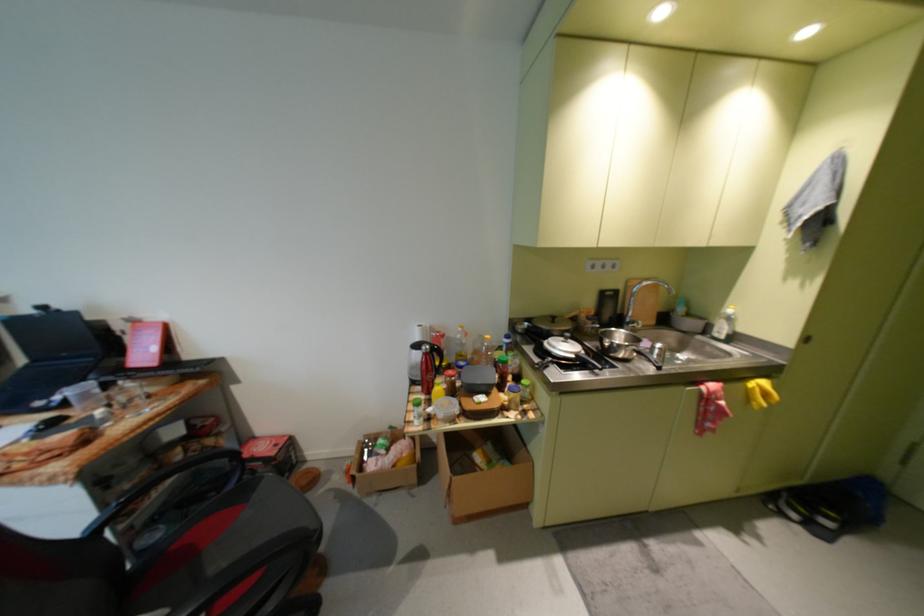
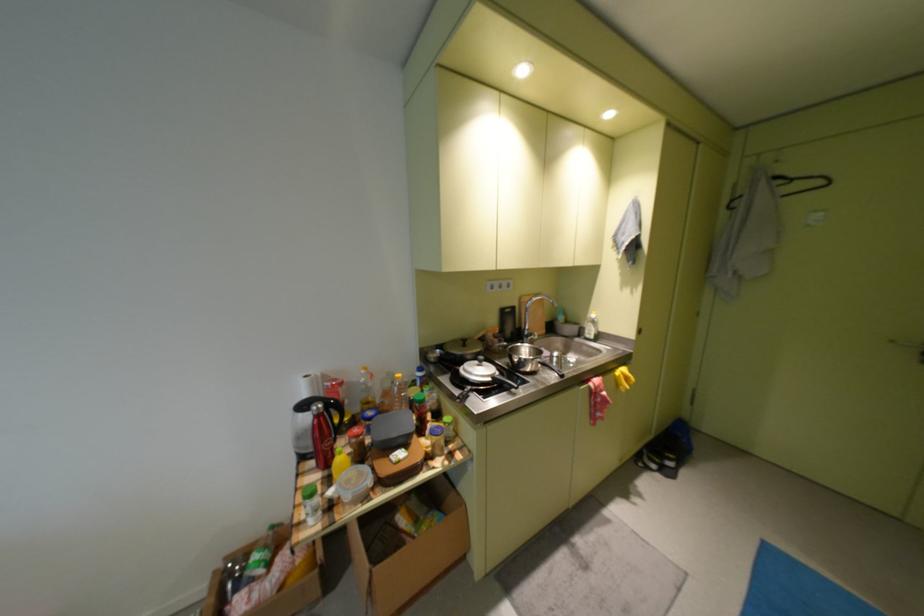
Question: How did the camera likely rotate?

Choices:
 (A) Left
 (B) Right
 (C) Up
 (D) Down

Answer: (B)